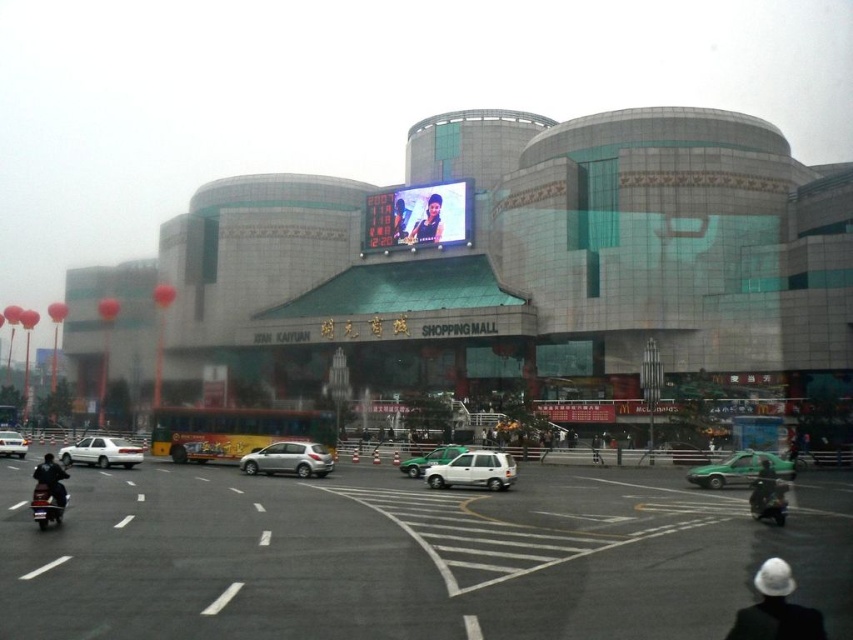
Question: Which of the following is the farthest from the observer?

Choices:
 (A) (294, 449)
 (B) (68, 476)

Answer: (A)

Question: Does white matte sedan at center appear on the left side of dark blue leather jacket at lower left?

Choices:
 (A) yes
 (B) no

Answer: (A)

Question: Observing the image, what is the correct spatial positioning of white glossy sedan at lower left in reference to smooth skin face at center?

Choices:
 (A) below
 (B) above

Answer: (A)

Question: Which point is closer to the camera?

Choices:
 (A) black asphalt road at center
 (B) dark blue leather jacket at lower left

Answer: (A)

Question: Which object is closer to the camera taking this photo?

Choices:
 (A) black asphalt road at center
 (B) white matte suv at center
 (C) green matte taxi at center

Answer: (A)

Question: Does glassy gray building at center come in front of dark green helmet at lower right?

Choices:
 (A) no
 (B) yes

Answer: (A)